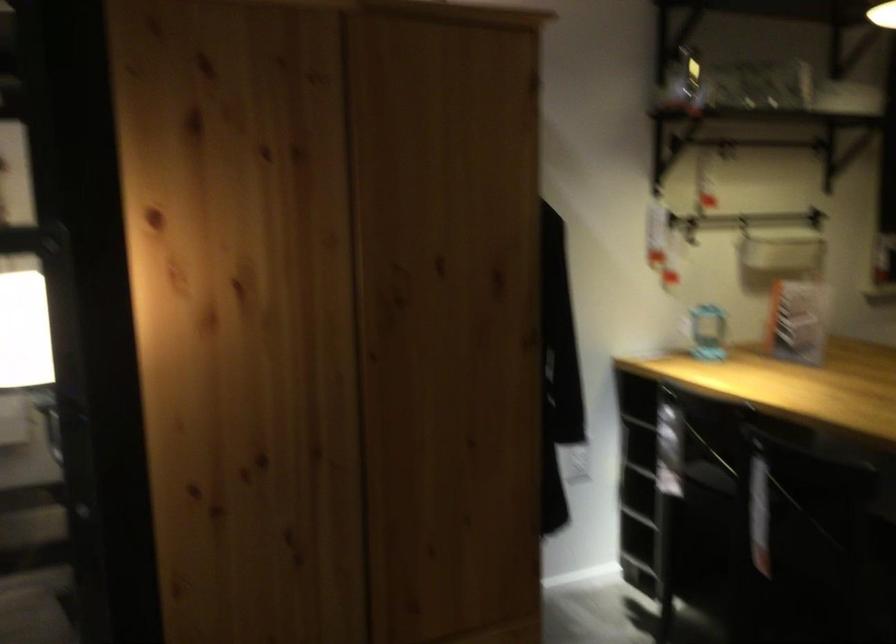
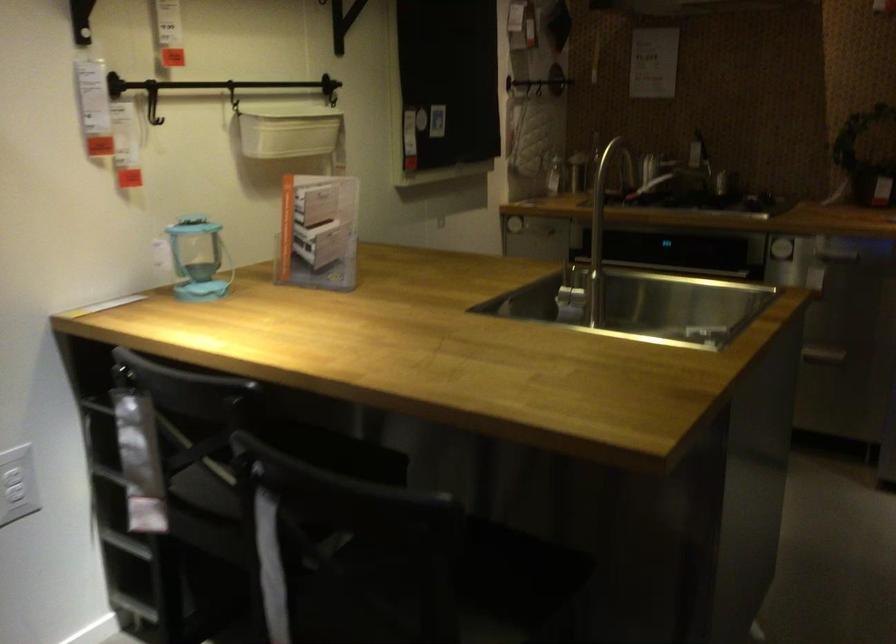
Question: How did the camera likely rotate?

Choices:
 (A) Left
 (B) Right
 (C) Up
 (D) Down

Answer: (B)